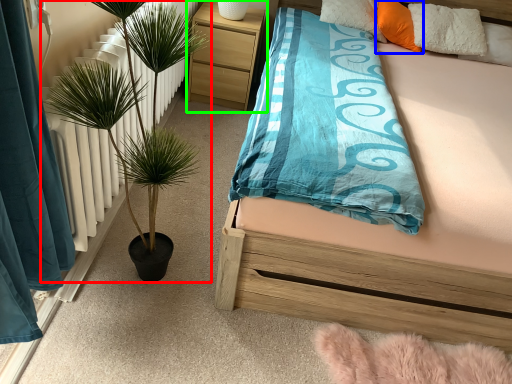
Question: Based on their relative distances, which object is farther from houseplant (highlighted by a red box)? Choose from pillow (highlighted by a blue box) and nightstand (highlighted by a green box).

Choices:
 (A) pillow
 (B) nightstand

Answer: (A)